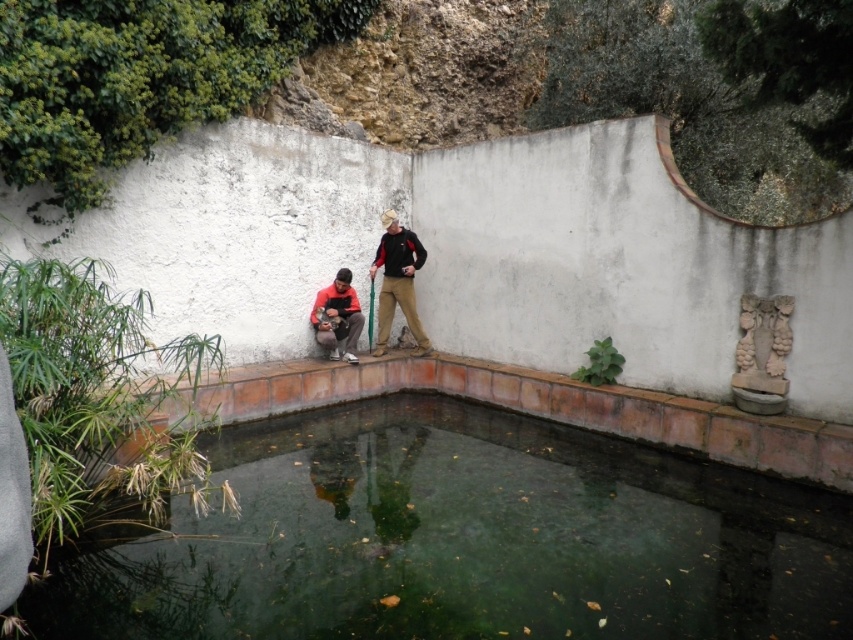
Who is positioned more to the right, matte black jacket at center or matte orange jacket at lower center?

matte black jacket at center is more to the right.

Does matte black jacket at center appear on the left side of matte orange jacket at lower center?

Incorrect, matte black jacket at center is not on the left side of matte orange jacket at lower center.

Describe the element at coordinates (398, 282) in the screenshot. Image resolution: width=853 pixels, height=640 pixels. I see `matte black jacket at center` at that location.

Identify the location of matte black jacket at center. This screenshot has height=640, width=853. (398, 282).

Who is higher up, green smooth water at center or matte orange jacket at lower center?

matte orange jacket at lower center

Which is in front, point (392, 472) or point (334, 291)?

Point (392, 472)

Between point (639, 595) and point (354, 291), which one is positioned behind?

The point (354, 291) is more distant.

Find the location of a particular element. This screenshot has width=853, height=640. green smooth water at center is located at coordinates pyautogui.click(x=465, y=540).

The height and width of the screenshot is (640, 853). What do you see at coordinates (527, 408) in the screenshot?
I see `terracotta tile ledge at center` at bounding box center [527, 408].

You are a GUI agent. You are given a task and a screenshot of the screen. Output one action in this format:
    pyautogui.click(x=<x>, y=<y>)
    Task: Click on the terracotta tile ledge at center
    
    Given the screenshot: What is the action you would take?
    click(527, 408)

In order to click on terracotta tile ledge at center in this screenshot , I will do `click(527, 408)`.